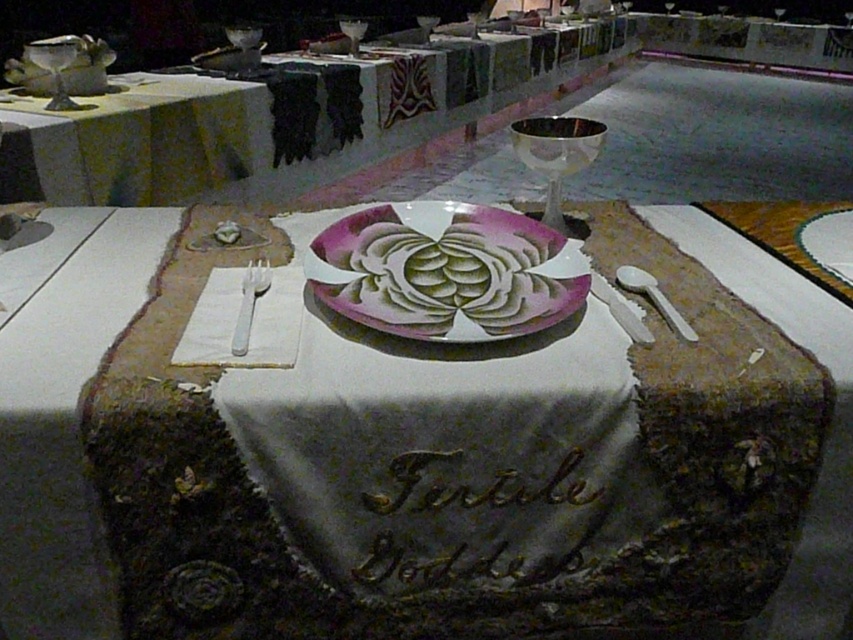
Question: Which point appears closest to the camera in this image?

Choices:
 (A) (55, 65)
 (B) (103, 588)
 (C) (392, 61)
 (D) (432, 17)

Answer: (B)

Question: Is white fabric table at center to the left of shiny silver wine glass at center from the viewer's perspective?

Choices:
 (A) no
 (B) yes

Answer: (A)

Question: In this image, where is silver metallic goblet at center located relative to white plastic spoon at right?

Choices:
 (A) left
 (B) right

Answer: (A)

Question: Is metallic silver goblet at upper left positioned in front of white plastic spoon at right?

Choices:
 (A) no
 (B) yes

Answer: (A)

Question: Based on their relative distances, which object is nearer to the shiny silver wine glass at center?

Choices:
 (A) pink glossy platter at center
 (B) shiny silver goblet at upper center

Answer: (B)

Question: Which of the following is the closest to the observer?

Choices:
 (A) shiny silver wine glass at center
 (B) pink glossy platter at center
 (C) metallic silver goblet at upper center
 (D) white plastic spoon at right

Answer: (B)